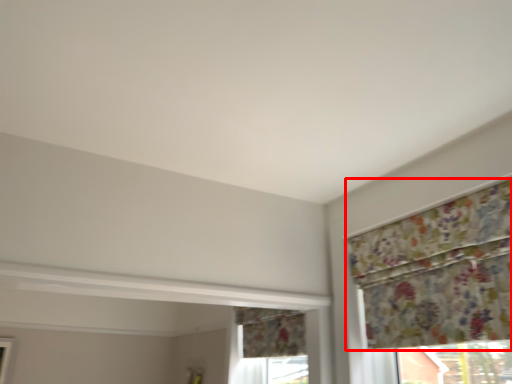
Question: From the image's perspective, where is curtain (annotated by the red box) located in relation to window in the image?

Choices:
 (A) above
 (B) below

Answer: (A)